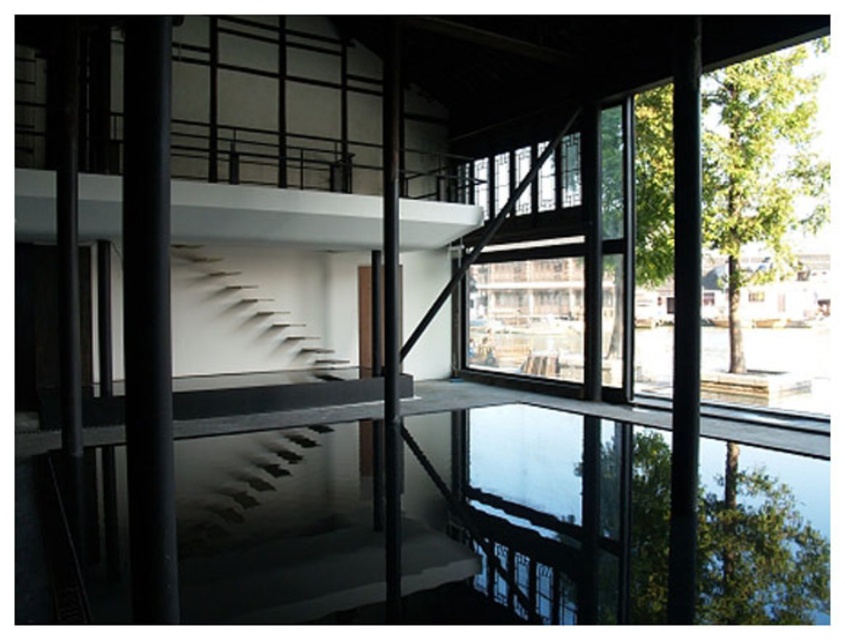
Does transparent glass pool at center have a greater height compared to white matte stairs at center?

In fact, transparent glass pool at center may be shorter than white matte stairs at center.

Where is `transparent glass pool at center`? transparent glass pool at center is located at coordinates (271, 531).

Find the location of a particular element. The height and width of the screenshot is (640, 845). transparent glass pool at center is located at coordinates (271, 531).

Is white matte stairs at center closer to the viewer compared to clear glass window at center?

Yes.

Between white matte stairs at center and clear glass window at center, which one appears on the left side from the viewer's perspective?

white matte stairs at center is more to the left.

Identify the location of white matte stairs at center. Image resolution: width=845 pixels, height=640 pixels. (251, 308).

At what (x,y) coordinates should I click in order to perform the action: click on white matte stairs at center. Please return your answer as a coordinate pair (x, y). Image resolution: width=845 pixels, height=640 pixels. Looking at the image, I should click on (251, 308).

Which is in front, point (352, 550) or point (493, 198)?

Point (352, 550) is more forward.

You are a GUI agent. You are given a task and a screenshot of the screen. Output one action in this format:
    pyautogui.click(x=<x>, y=<y>)
    Task: Click on the transparent glass pool at center
    This screenshot has width=845, height=640.
    Given the screenshot: What is the action you would take?
    pyautogui.click(x=271, y=531)